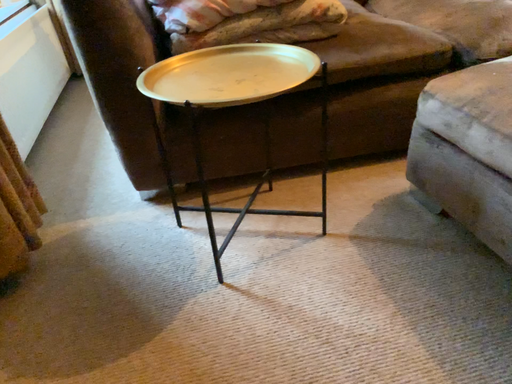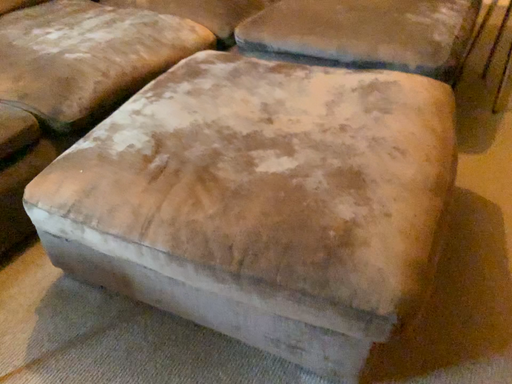
Question: Which way did the camera rotate in the video?

Choices:
 (A) rotated downward
 (B) rotated upward

Answer: (B)